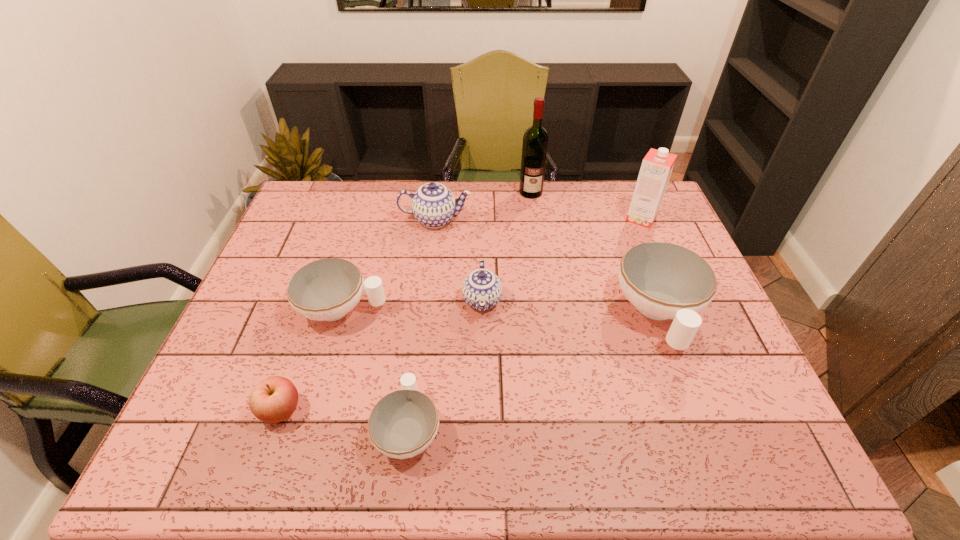
Identify the location of chinaware at the right edge. This screenshot has width=960, height=540. (662, 280).

This screenshot has width=960, height=540. Find the location of `object situated at the near left corner`. object situated at the near left corner is located at coordinates (273, 400).

Find the location of a particular element. The image size is (960, 540). object that is at the far right corner is located at coordinates (657, 165).

What are the coordinates of `vacant space at the far edge` in the screenshot? It's located at (599, 188).

What are the coordinates of `blank space at the near edge of the desktop` in the screenshot? It's located at (353, 448).

The image size is (960, 540). In the image, there is a desktop. What are the coordinates of `free region at the left edge` in the screenshot? It's located at (275, 246).

Identify the location of vacant area at the right edge of the desktop. The height and width of the screenshot is (540, 960). (677, 354).

This screenshot has height=540, width=960. What are the coordinates of `free point at the far left corner` in the screenshot? It's located at (331, 216).

The width and height of the screenshot is (960, 540). In order to click on vacant region between the shortest object and the apple in this screenshot , I will do `click(345, 419)`.

Locate an element on the screen. The image size is (960, 540). free spot between the apple and the tallest object is located at coordinates (406, 301).